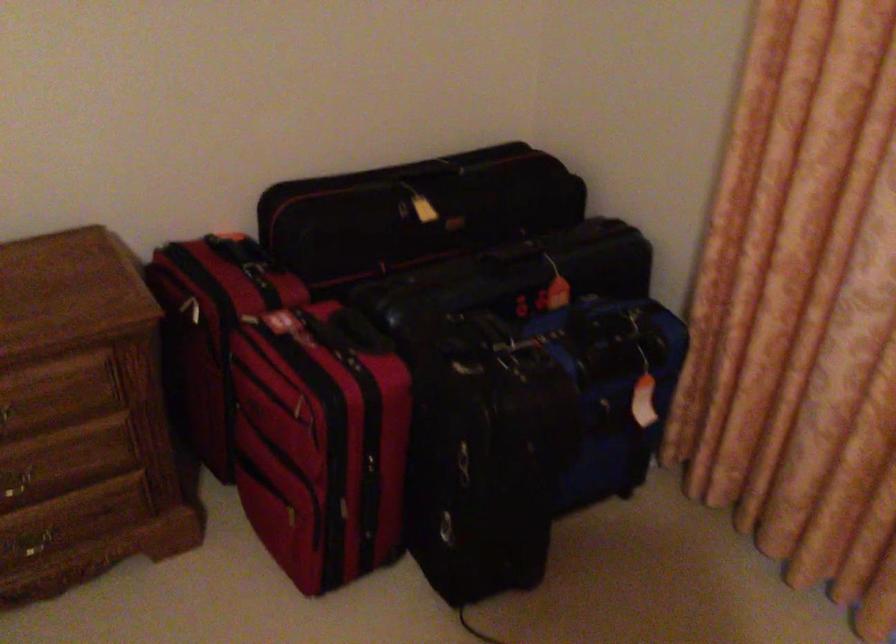
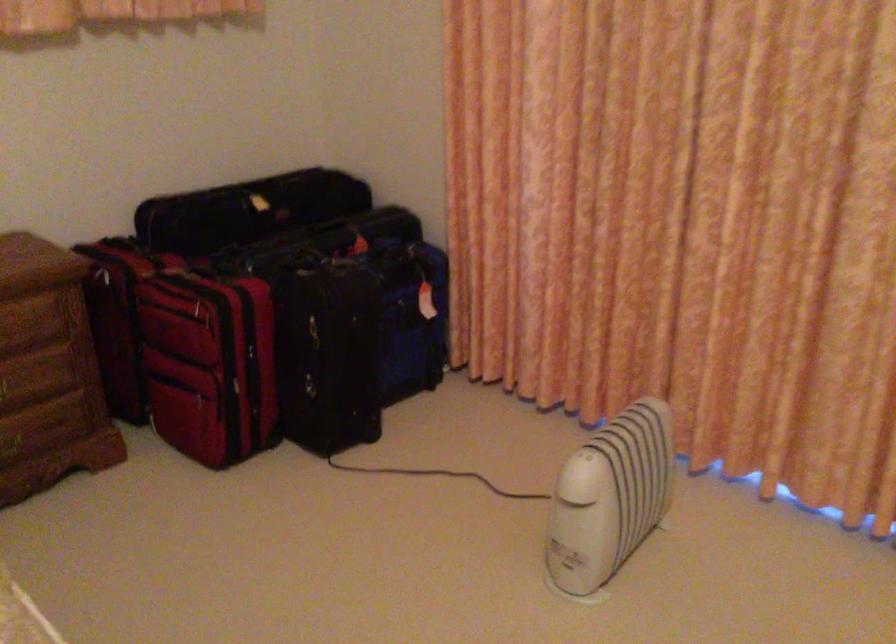
The point at (307, 471) is marked in the first image. Where is the corresponding point in the second image?

(209, 364)